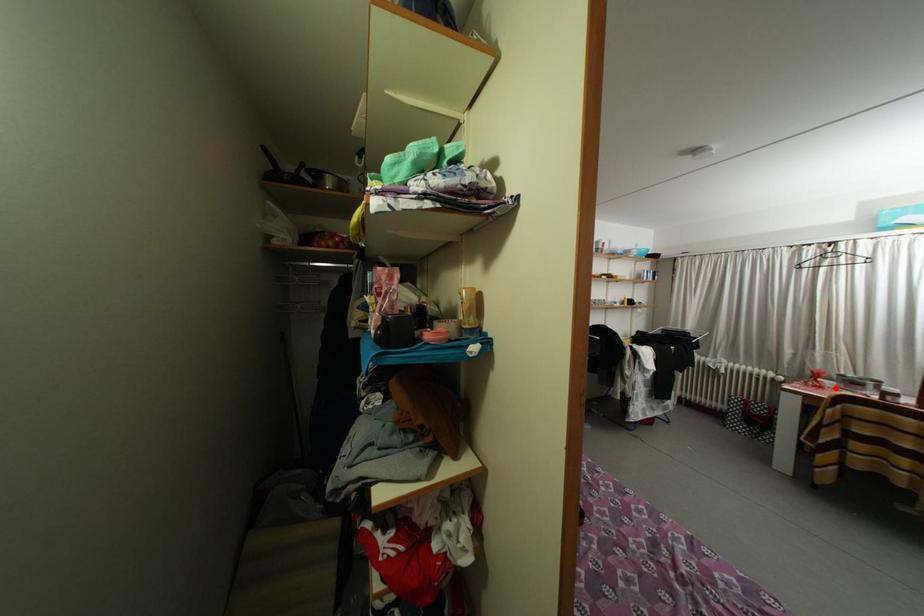
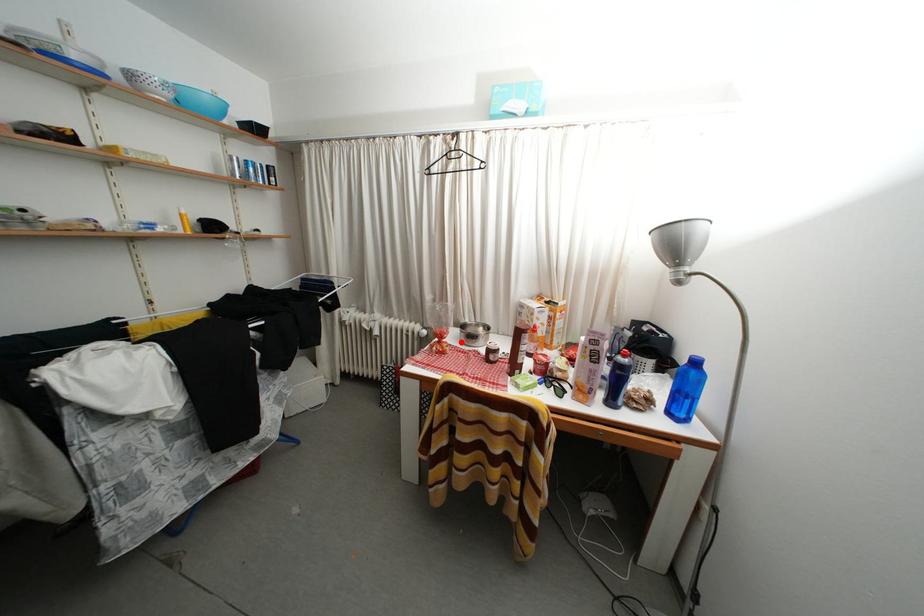
I am providing you with two images of the same scene from different viewpoints. A red point is marked on the first image and another point is marked on the second image. Does the point marked in image1 correspond to the same location as the one in image2?

Yes